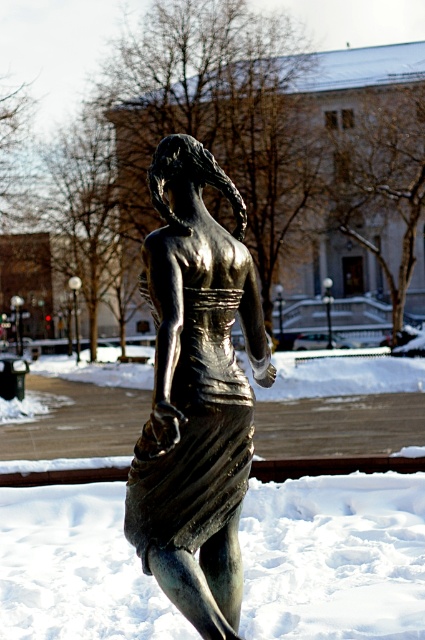
The image size is (425, 640). What do you see at coordinates (334, 557) in the screenshot?
I see `white frosty snow at lower center` at bounding box center [334, 557].

Does point (272, 625) come behind point (207, 496)?

Yes.

Locate an element on the screen. This screenshot has width=425, height=640. white frosty snow at lower center is located at coordinates (334, 557).

Is white frosty snow at lower center to the right of shiny bronze dress at center from the viewer's perspective?

No, white frosty snow at lower center is not to the right of shiny bronze dress at center.

Between white frosty snow at lower center and shiny bronze dress at center, which one has less height?

Standing shorter between the two is white frosty snow at lower center.

I want to click on white frosty snow at lower center, so click(x=334, y=557).

Who is taller, shiny bronze statue at center or shiny bronze dress at center?

shiny bronze statue at center

Is the position of shiny bronze statue at center less distant than that of shiny bronze dress at center?

Yes.

Is point (203, 310) behind point (170, 451)?

Yes.

Locate an element on the screen. This screenshot has width=425, height=640. shiny bronze statue at center is located at coordinates pos(195,394).